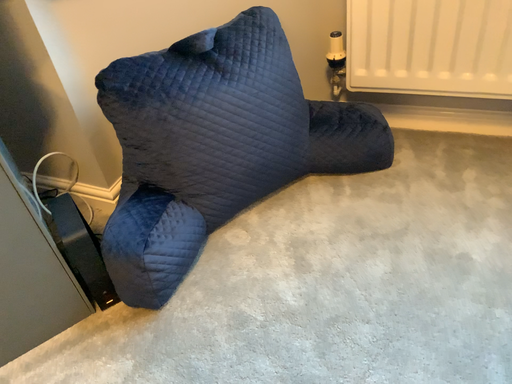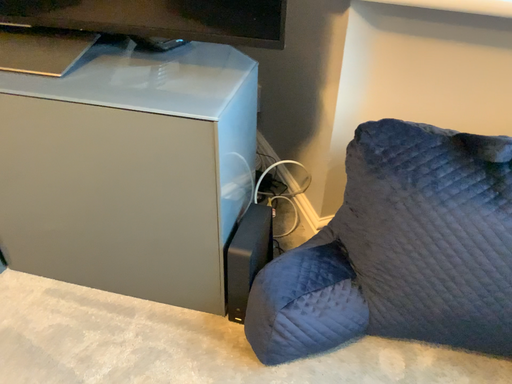
Question: How did the camera likely rotate when shooting the video?

Choices:
 (A) rotated upward
 (B) rotated downward

Answer: (A)